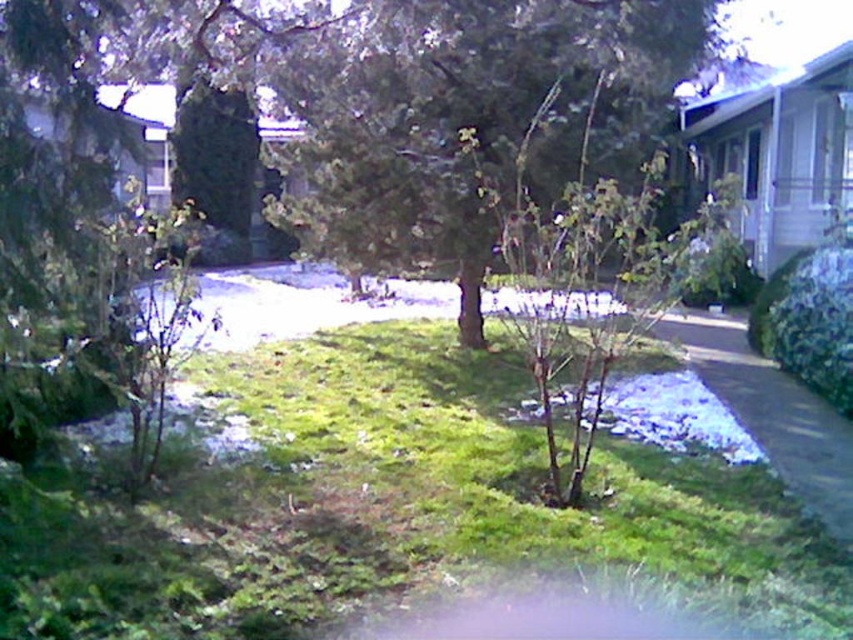
Question: Can you confirm if green grass at center is bigger than green textured tree at center?

Choices:
 (A) yes
 (B) no

Answer: (B)

Question: In this image, where is green grass at center located relative to green textured tree at center?

Choices:
 (A) right
 (B) left

Answer: (B)

Question: Which point is closer to the camera?

Choices:
 (A) green textured tree at center
 (B) green grass at center

Answer: (B)

Question: Which point is closer to the camera?

Choices:
 (A) (724, 520)
 (B) (561, 28)

Answer: (A)

Question: Does green grass at center have a greater width compared to green textured tree at center?

Choices:
 (A) no
 (B) yes

Answer: (A)